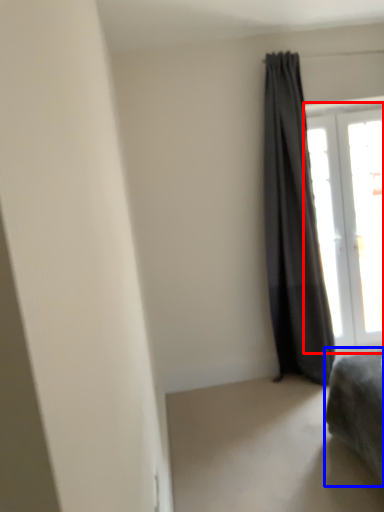
Question: Which point is closer to the camera, window (highlighted by a red box) or furniture (highlighted by a blue box)?

Choices:
 (A) window
 (B) furniture

Answer: (B)